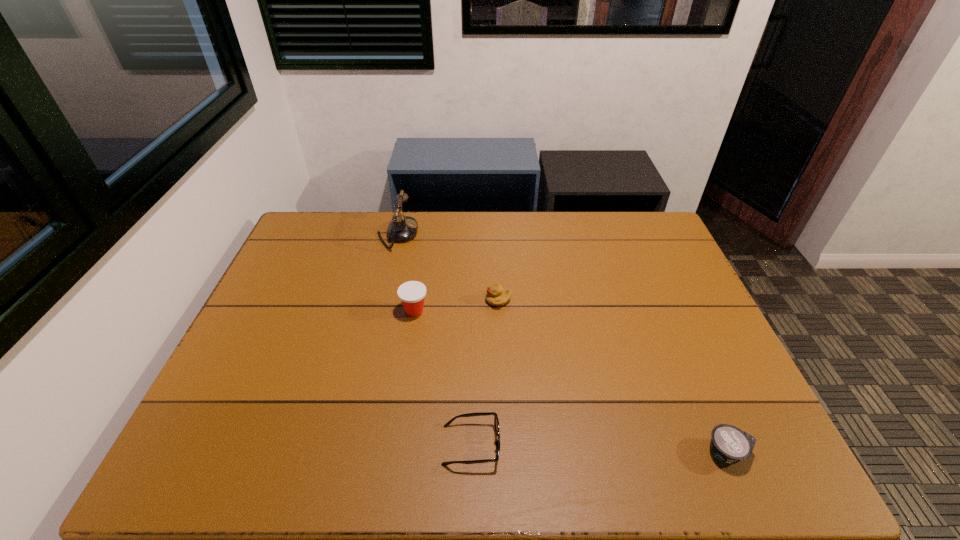
Locate an element on the screen. This screenshot has width=960, height=540. the tallest object is located at coordinates (401, 229).

I want to click on telephone, so click(401, 229).

Where is `Dixie cup`? The image size is (960, 540). Dixie cup is located at coordinates (412, 293).

Locate an element on the screen. the third tallest object is located at coordinates (496, 296).

This screenshot has height=540, width=960. I want to click on the rightmost object, so click(x=729, y=444).

Locate an element on the screen. spectacles is located at coordinates (496, 422).

Find the location of a particular element. The width and height of the screenshot is (960, 540). vacant space located 0.380m on the dial of the tallest object is located at coordinates (524, 234).

Locate an element on the screen. free location located 0.150m on the front of the fourth shortest object is located at coordinates (407, 364).

Identify the location of vacant space located 0.270m at the beak of the third tallest object. The height and width of the screenshot is (540, 960). (396, 300).

Where is `vacant space located at the beak of the third tallest object`? The width and height of the screenshot is (960, 540). vacant space located at the beak of the third tallest object is located at coordinates (405, 300).